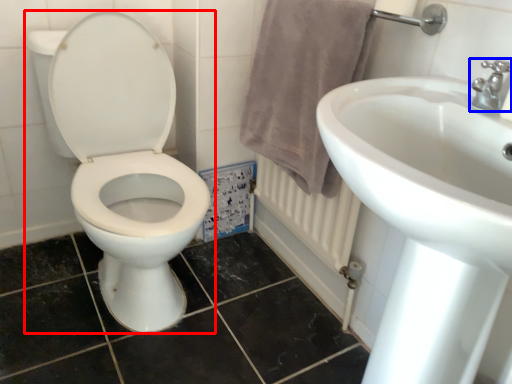
Question: Among these objects, which one is nearest to the camera, toilet (highlighted by a red box) or tap (highlighted by a blue box)?

Choices:
 (A) toilet
 (B) tap

Answer: (B)